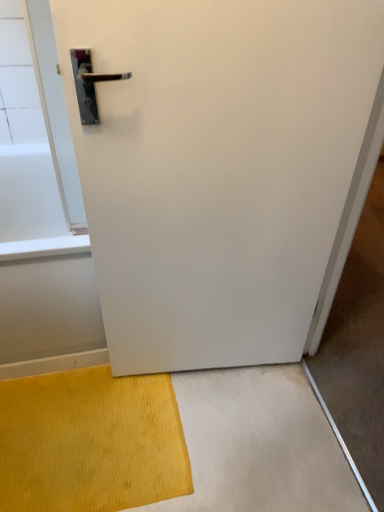
Question: From a real-world perspective, is white matte door at center physically located above or below yellow textured mat at lower left?

Choices:
 (A) below
 (B) above

Answer: (B)

Question: Is point (372, 145) positioned closer to the camera than point (31, 450)?

Choices:
 (A) closer
 (B) farther

Answer: (A)

Question: From their relative heights in the image, would you say white matte door at center is taller or shorter than yellow textured mat at lower left?

Choices:
 (A) short
 (B) tall

Answer: (B)

Question: From their relative heights in the image, would you say yellow textured mat at lower left is taller or shorter than white matte door at center?

Choices:
 (A) short
 (B) tall

Answer: (A)

Question: Considering the positions of yellow textured mat at lower left and white matte door at center in the image, is yellow textured mat at lower left bigger or smaller than white matte door at center?

Choices:
 (A) big
 (B) small

Answer: (B)

Question: From the image's perspective, relative to white matte door at center, is yellow textured mat at lower left above or below?

Choices:
 (A) below
 (B) above

Answer: (A)

Question: Considering the positions of yellow textured mat at lower left and white matte door at center in the image, is yellow textured mat at lower left wider or thinner than white matte door at center?

Choices:
 (A) wide
 (B) thin

Answer: (A)